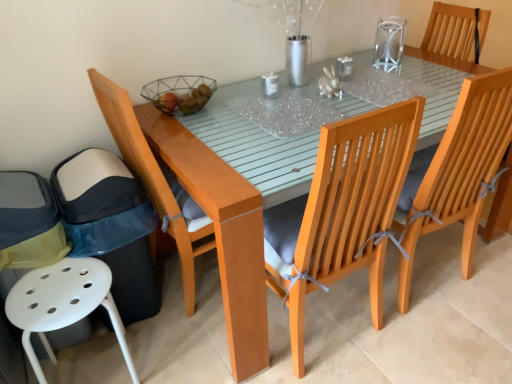
What is the approximate width of transparent glass table at upper center, which ranks as the first glass table in right-to-left order?

It is 18.24 inches.

Describe the element at coordinates (149, 175) in the screenshot. The height and width of the screenshot is (384, 512). I see `light brown wood chair at left, positioned as the 4th chair in right-to-left order` at that location.

What do you see at coordinates (63, 304) in the screenshot? I see `white plastic stool at lower left, acting as the 1th chair starting from the left` at bounding box center [63, 304].

Locate an element on the screen. transparent glass table at upper center, which ranks as the first glass table in right-to-left order is located at coordinates (383, 87).

From the image's perspective, relative to clear glass vase at upper right, is light brown wood chair at left, the second chair in the left-to-right sequence, above or below?

Clearly, from the image's perspective, light brown wood chair at left, the second chair in the left-to-right sequence, is below clear glass vase at upper right.

Is light brown wood chair at left, the second chair in the left-to-right sequence, wider or thinner than clear glass vase at upper right?

Clearly, light brown wood chair at left, the second chair in the left-to-right sequence, has more width compared to clear glass vase at upper right.

Could clear glass vase at upper right be considered to be inside light brown wood chair at left, positioned as the 4th chair in right-to-left order?

No, clear glass vase at upper right is located outside of light brown wood chair at left, positioned as the 4th chair in right-to-left order.

Is white plastic stool at lower left, the fifth chair from the right, positioned beyond the bounds of glossy wood table at center?

Absolutely, white plastic stool at lower left, the fifth chair from the right, is external to glossy wood table at center.

Is white plastic stool at lower left, the fifth chair from the right, oriented towards glossy wood table at center?

No, white plastic stool at lower left, the fifth chair from the right, is not aimed at glossy wood table at center.

Is white plastic stool at lower left, acting as the 1th chair starting from the left, at the left side of glossy wood table at center?

Yes, white plastic stool at lower left, acting as the 1th chair starting from the left, is to the left of glossy wood table at center.

Does white plastic stool at lower left, acting as the 1th chair starting from the left, touch glossy wood table at center?

white plastic stool at lower left, acting as the 1th chair starting from the left, and glossy wood table at center are not in contact.

Is wooden chair with grey cushion at center, the 3th chair from the left, bigger than white plastic stool at lower left, acting as the 1th chair starting from the left?

Yes.

From a real-world perspective, is wooden chair with grey cushion at center, the 3th chair viewed from the right, on white plastic stool at lower left, acting as the 1th chair starting from the left?

Yes, from a real-world perspective, wooden chair with grey cushion at center, the 3th chair viewed from the right, is on top of white plastic stool at lower left, acting as the 1th chair starting from the left.

From the picture: Measure the distance between wooden chair with grey cushion at center, the 3th chair from the left, and white plastic stool at lower left, the fifth chair from the right.

The distance of wooden chair with grey cushion at center, the 3th chair from the left, from white plastic stool at lower left, the fifth chair from the right, is 27.94 inches.

Between wooden chair with grey cushion at center, the 3th chair from the left, and white plastic stool at lower left, the fifth chair from the right, which one has more height?

wooden chair with grey cushion at center, the 3th chair from the left, is taller.

Which object is closer to the camera, wooden chair with grey cushion at center, the 3th chair from the left, or clear glass vase at upper right?

wooden chair with grey cushion at center, the 3th chair from the left, is more forward.

Based on the photo, considering the sizes of objects wooden chair with grey cushion at center, the 3th chair viewed from the right, and clear glass vase at upper right in the image provided, who is wider, wooden chair with grey cushion at center, the 3th chair viewed from the right, or clear glass vase at upper right?

wooden chair with grey cushion at center, the 3th chair viewed from the right, is wider.

Which of these two, wooden chair with grey cushion at center, the 3th chair viewed from the right, or clear glass vase at upper right, is bigger?

wooden chair with grey cushion at center, the 3th chair viewed from the right, is bigger.

Considering the points (254, 112) and (492, 217), which point is behind, point (254, 112) or point (492, 217)?

The point (492, 217) is farther from the camera.

Would you say transparent plastic table at center, the second glass table viewed from the right, contains glossy wood table at center?

Actually, glossy wood table at center is outside transparent plastic table at center, the second glass table viewed from the right.

Considering the positions of objects transparent plastic table at center, the 1th glass table viewed from the left, and glossy wood table at center in the image provided, who is more to the left, transparent plastic table at center, the 1th glass table viewed from the left, or glossy wood table at center?

Positioned to the left is transparent plastic table at center, the 1th glass table viewed from the left.

From the image's perspective, who appears lower, transparent plastic table at center, the 1th glass table viewed from the left, or glossy wood table at center?

glossy wood table at center, from the image's perspective.

Who is shorter, transparent glass table at upper center, which ranks as the first glass table in right-to-left order, or clear glass vase at upper right?

Standing shorter between the two is transparent glass table at upper center, which ranks as the first glass table in right-to-left order.

Between transparent glass table at upper center, which ranks as the first glass table in right-to-left order, and clear glass vase at upper right, which one has smaller size?

transparent glass table at upper center, which ranks as the first glass table in right-to-left order, is smaller.

Is transparent glass table at upper center, arranged as the second glass table when viewed from the left, next to clear glass vase at upper right?

There is a gap between transparent glass table at upper center, arranged as the second glass table when viewed from the left, and clear glass vase at upper right.

Is transparent glass table at upper center, which ranks as the first glass table in right-to-left order, positioned with its back to clear glass vase at upper right?

No, transparent glass table at upper center, which ranks as the first glass table in right-to-left order, is not facing away from clear glass vase at upper right.

Which object is thinner, white plastic stool at lower left, the fifth chair from the right, or light brown wood chair at left, positioned as the 4th chair in right-to-left order?

Thinner between the two is white plastic stool at lower left, the fifth chair from the right.

Which of these two, white plastic stool at lower left, acting as the 1th chair starting from the left, or light brown wood chair at left, positioned as the 4th chair in right-to-left order, is smaller?

white plastic stool at lower left, acting as the 1th chair starting from the left, is smaller.

From the image's perspective, between white plastic stool at lower left, the fifth chair from the right, and light brown wood chair at left, the second chair in the left-to-right sequence, which one is located above?

light brown wood chair at left, the second chair in the left-to-right sequence.

The image size is (512, 384). What are the coordinates of `chair below the light brown wood chair at left, positioned as the 4th chair in right-to-left order (from a real-world perspective)` in the screenshot? It's located at (63, 304).

The height and width of the screenshot is (384, 512). What are the coordinates of `clear on the right of light brown wood chair at left, positioned as the 4th chair in right-to-left order` in the screenshot? It's located at (389, 43).

Locate an element on the screen. This screenshot has height=384, width=512. chair that is the 3rd one when counting downward from the glossy wood table at center (from the image's perspective) is located at coordinates (63, 304).

Estimate the real-world distances between objects in this image. Which object is further from clear glass vase at upper right, wooden chair with grey cushion at right, the 2th chair positioned from the right, or wire mesh basket at center?

The object further to clear glass vase at upper right is wire mesh basket at center.

Considering their positions, is wooden chair with grey cushion at center, the 3th chair viewed from the right, positioned closer to transparent plastic table at center, the 1th glass table viewed from the left, than glossy wood table at center?

Among the two, glossy wood table at center is located nearer to transparent plastic table at center, the 1th glass table viewed from the left.

When comparing their distances from white plastic stool at lower left, the fifth chair from the right, does wire mesh basket at center or transparent plastic table at center, the second glass table viewed from the right, seem further?

The object further to white plastic stool at lower left, the fifth chair from the right, is transparent plastic table at center, the second glass table viewed from the right.

When comparing their distances from wooden chair with grey cushion at center, the 3th chair viewed from the right, does wire mesh basket at center or light brown wood chair at left, positioned as the 4th chair in right-to-left order, seem further?

wire mesh basket at center is further to wooden chair with grey cushion at center, the 3th chair viewed from the right.

From the image, which object appears to be farther from white plastic stool at lower left, the fifth chair from the right, wire mesh basket at center or transparent glass table at upper center, arranged as the second glass table when viewed from the left?

Based on the image, transparent glass table at upper center, arranged as the second glass table when viewed from the left, appears to be further to white plastic stool at lower left, the fifth chair from the right.

Looking at the image, which one is located further to clear glass vase at upper right, transparent glass table at upper center, which ranks as the first glass table in right-to-left order, or light brown wood chair at left, the second chair in the left-to-right sequence?

Based on the image, light brown wood chair at left, the second chair in the left-to-right sequence, appears to be further to clear glass vase at upper right.

Estimate the real-world distances between objects in this image. Which object is further from transparent plastic table at center, the second glass table viewed from the right, white plastic stool at lower left, acting as the 1th chair starting from the left, or light brown wood chair at left, the second chair in the left-to-right sequence?

white plastic stool at lower left, acting as the 1th chair starting from the left, lies further to transparent plastic table at center, the second glass table viewed from the right, than the other object.

Based on the photo, looking at the image, which one is located further to wooden chair with grey cushion at center, the 3th chair from the left, wooden chair at upper right, the fifth chair from the left, or light brown wood chair at left, the second chair in the left-to-right sequence?

Based on the image, wooden chair at upper right, the fifth chair from the left, appears to be further to wooden chair with grey cushion at center, the 3th chair from the left.

Locate an element on the screen. Image resolution: width=512 pixels, height=384 pixels. basket between white plastic stool at lower left, acting as the 1th chair starting from the left, and transparent glass table at upper center, which ranks as the first glass table in right-to-left order, from left to right is located at coordinates (180, 93).

What are the coordinates of `table between light brown wood chair at left, positioned as the 4th chair in right-to-left order, and clear glass vase at upper right from left to right` in the screenshot? It's located at click(x=205, y=208).

You are a GUI agent. You are given a task and a screenshot of the screen. Output one action in this format:
    pyautogui.click(x=<x>, y=<y>)
    Task: Click on the table between light brown wood chair at left, positioned as the 4th chair in right-to-left order, and transparent glass table at upper center, which ranks as the first glass table in right-to-left order
    
    Given the screenshot: What is the action you would take?
    pyautogui.click(x=205, y=208)

Find the location of a particular element. This screenshot has height=384, width=512. table between light brown wood chair at left, the second chair in the left-to-right sequence, and wooden chair with grey cushion at right, acting as the 4th chair starting from the left, in the horizontal direction is located at coordinates (205, 208).